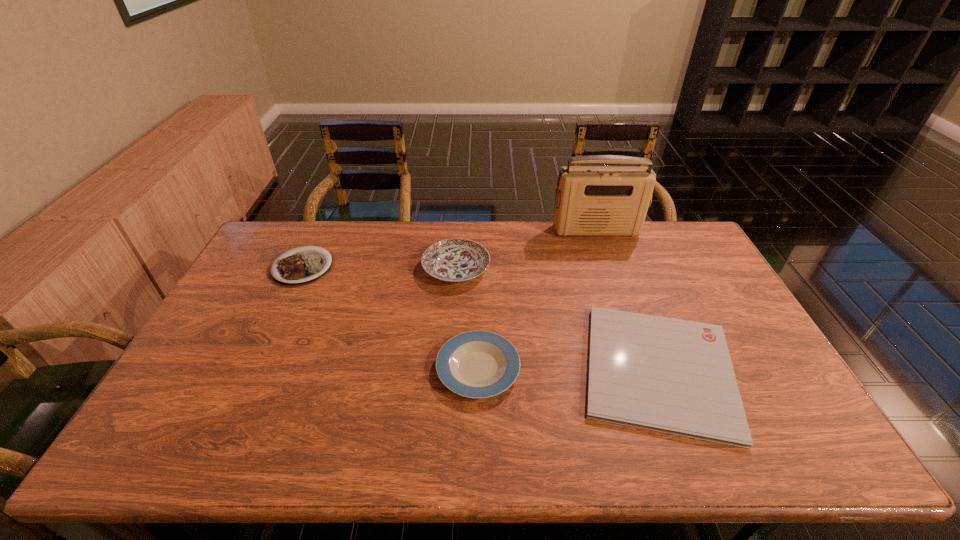
The image size is (960, 540). I want to click on vacant region located on the left of the clipboard, so click(x=430, y=370).

At what (x,y) coordinates should I click in order to perform the action: click on radio receiver located in the far edge section of the desktop. Please return your answer as a coordinate pair (x, y). Image resolution: width=960 pixels, height=540 pixels. Looking at the image, I should click on (590, 200).

I want to click on object at the near edge, so click(674, 376).

What are the coordinates of `object that is at the left edge` in the screenshot? It's located at (299, 267).

In order to click on object located at the right edge in this screenshot , I will do tap(674, 376).

Identify the location of object positioned at the far left corner. This screenshot has height=540, width=960. coord(299,267).

I want to click on object at the near right corner, so click(674, 376).

At what (x,y) coordinates should I click in order to perform the action: click on free space at the far edge of the desktop. Please return your answer as a coordinate pair (x, y). Looking at the image, I should click on (433, 226).

Locate an element on the screen. The width and height of the screenshot is (960, 540). free spot at the near edge of the desktop is located at coordinates (376, 448).

At what (x,y) coordinates should I click in order to perform the action: click on vacant area at the left edge. Please return your answer as a coordinate pair (x, y). Image resolution: width=960 pixels, height=540 pixels. Looking at the image, I should click on (238, 291).